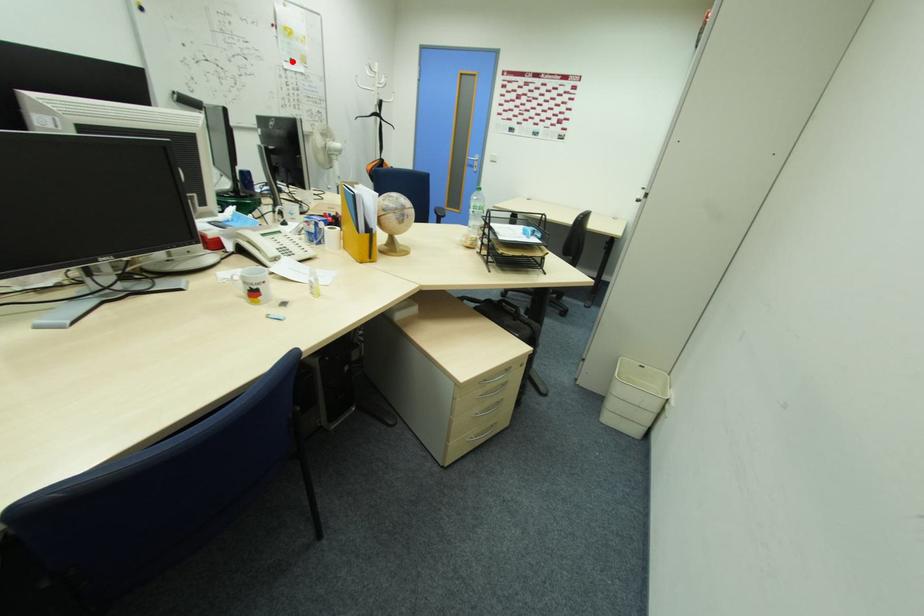
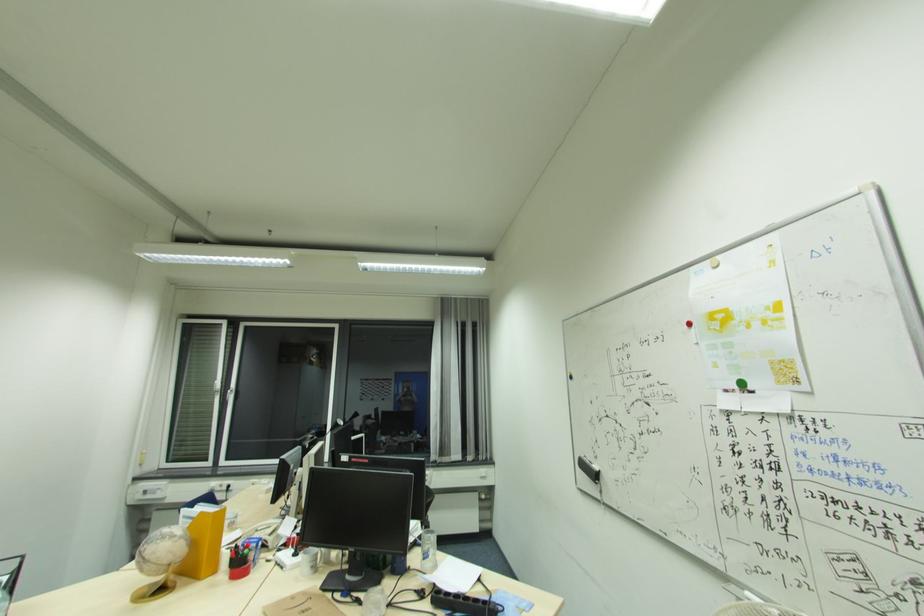
In the second image, find the point that corresponds to the highlighted location in the first image.

(739, 387)